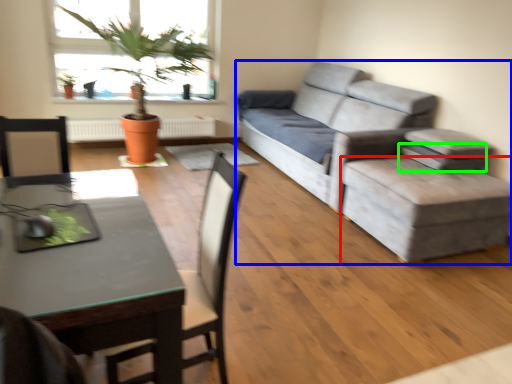
Question: Which is nearer to the stool (highlighted by a red box)? studio couch (highlighted by a blue box) or pillow (highlighted by a green box).

Choices:
 (A) studio couch
 (B) pillow

Answer: (A)